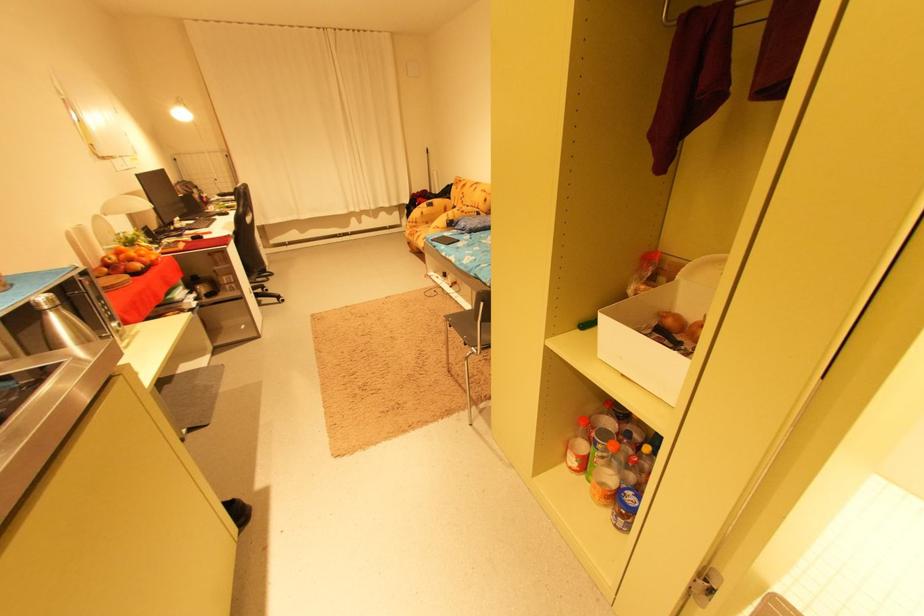
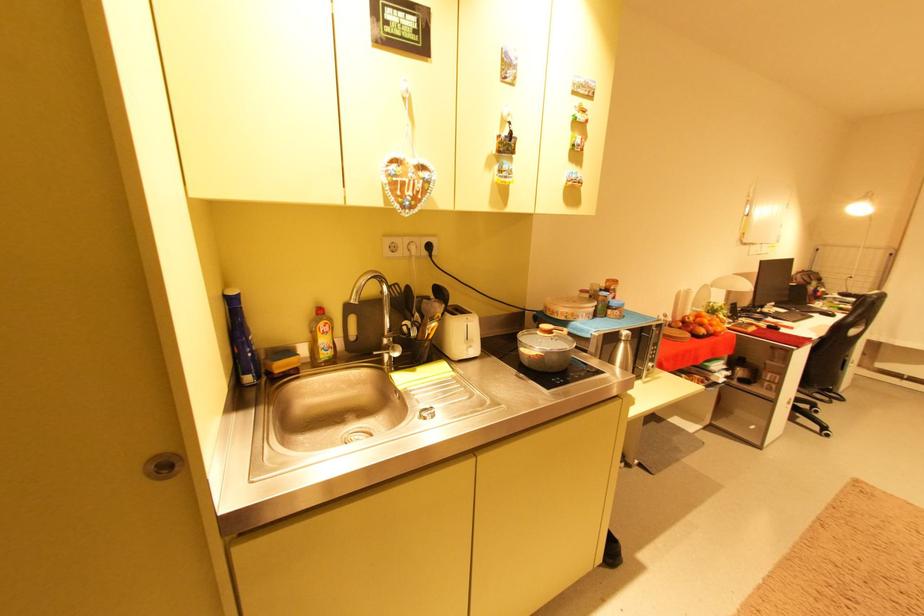
Question: The camera is either moving clockwise (left) or counter-clockwise (right) around the object. The first image is from the beginning of the video and the second image is from the end. Is the camera moving left or right when shooting the video?

Choices:
 (A) Left
 (B) Right

Answer: (B)